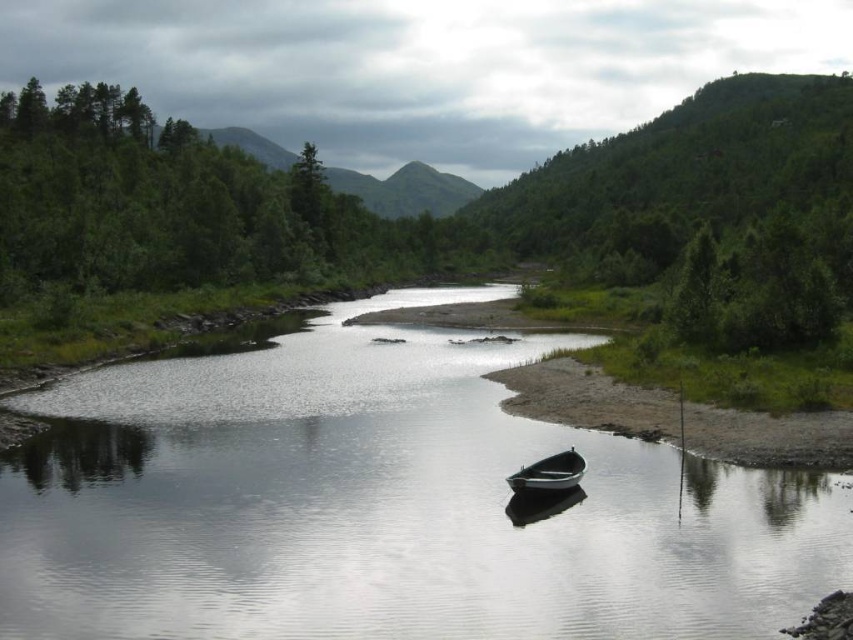
You are a kayaker planning to navigate the river shown in the image. You see the clear water at center and the metallic gray boat at center. Which object is located higher in the image?

The clear water at center is above the metallic gray boat at center, so the clear water at center is higher in the image.

You are planning to cross the river using a small raft. The clear water at center is deeper than the green grassy shore at lower right. Which area would be safer to navigate your raft through?

The clear water at center has a larger size compared to the green grassy shore at lower right, so it is safer to navigate your raft through the clear water at center because deeper water typically allows for smoother and safer passage compared to shallower areas near the shore.